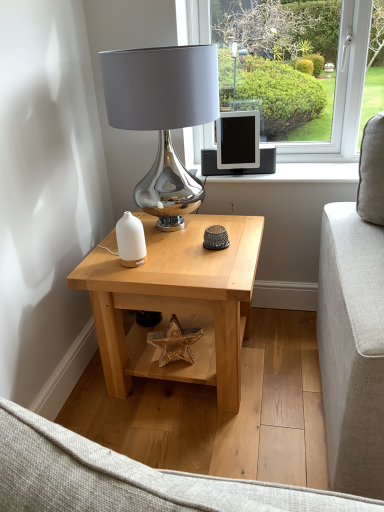
Identify the location of free point behind white glossy candle holder at center. (149, 242).